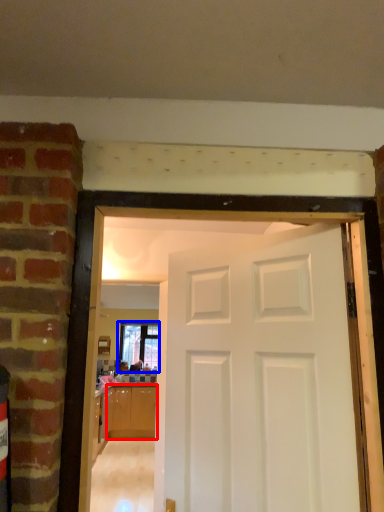
Question: Which of the following is the farthest to the observer, cabinetry (highlighted by a red box) or window (highlighted by a blue box)?

Choices:
 (A) cabinetry
 (B) window

Answer: (B)